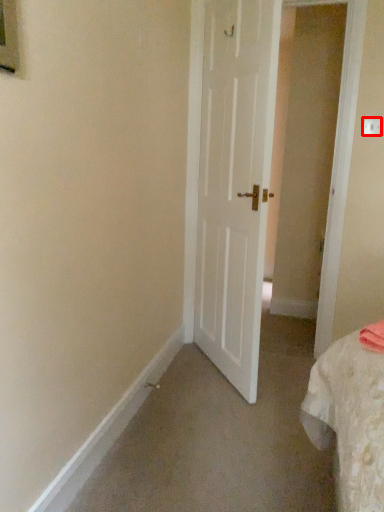
Question: From the image's perspective, considering the relative positions of electric outlet (annotated by the red box) and door in the image provided, where is electric outlet (annotated by the red box) located with respect to the staircase?

Choices:
 (A) below
 (B) above

Answer: (B)